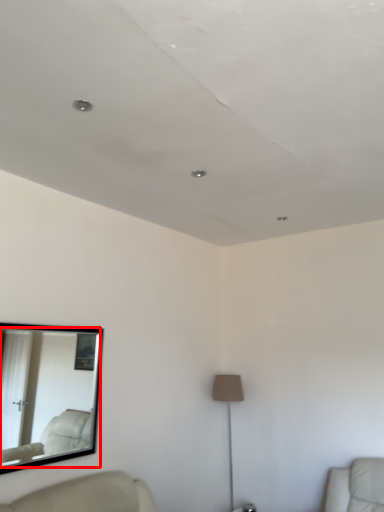
Question: In this image, where is mirror (annotated by the red box) located relative to lamp?

Choices:
 (A) right
 (B) left

Answer: (B)